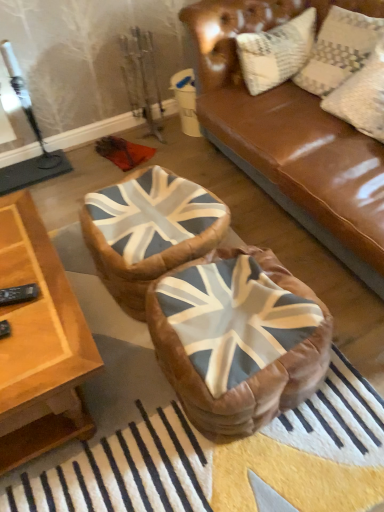
I want to click on free point above wooden table at lower left (from a real-world perspective), so click(21, 280).